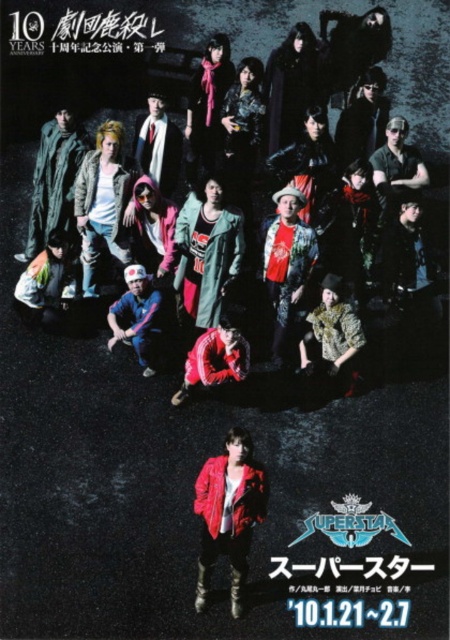
You are standing at the camera position looking at the promotional poster for the theatrical production. There is a point marked at coordinates point (232, 560) on the poster. If you want to touch this point with a 6.5 meter long pole, will the pole be long enough?

Result: The distance between point (232, 560) and the camera is 6.58 meters. Since the pole is only 6.5 meters long, it is slightly shorter than the required distance. Therefore, the pole will not be long enough to reach the point.

You are designing a promotional poster and need to place a spotlight on the shiny red leather jacket at center. According to the poster layout, where should you position the spotlight to ensure it directly illuminates the jacket?

The shiny red leather jacket at center is located at point (229, 515), so you should position the spotlight at that coordinate to directly illuminate it.